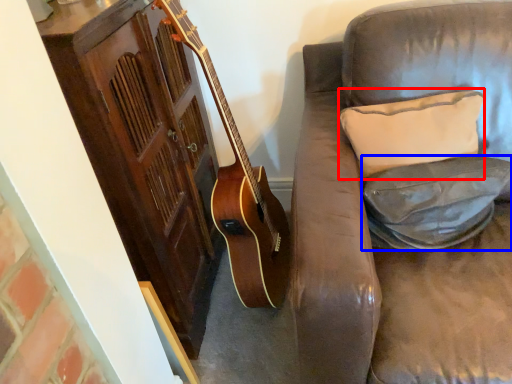
Question: Which of the following is the farthest to the observer, pillow (highlighted by a red box) or pillow (highlighted by a blue box)?

Choices:
 (A) pillow
 (B) pillow

Answer: (A)